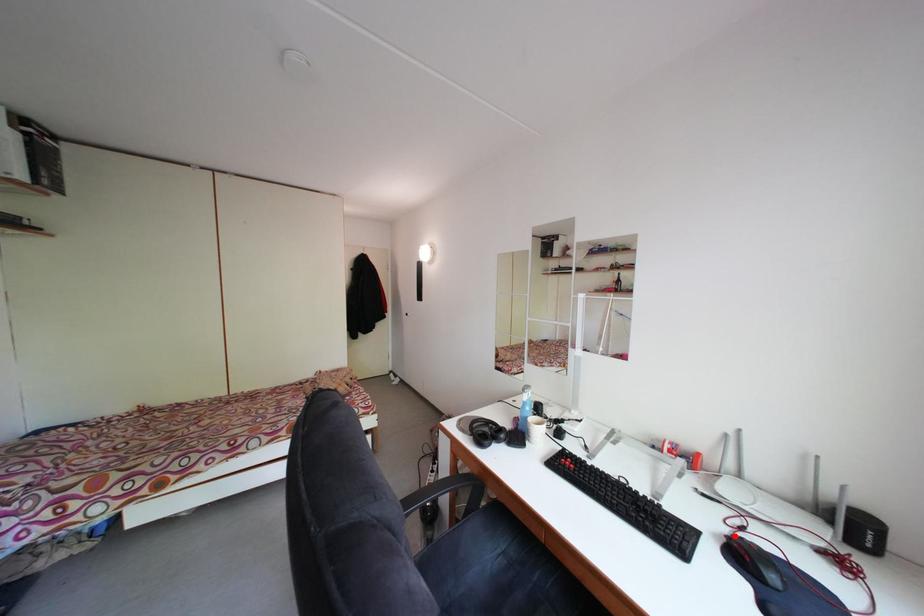
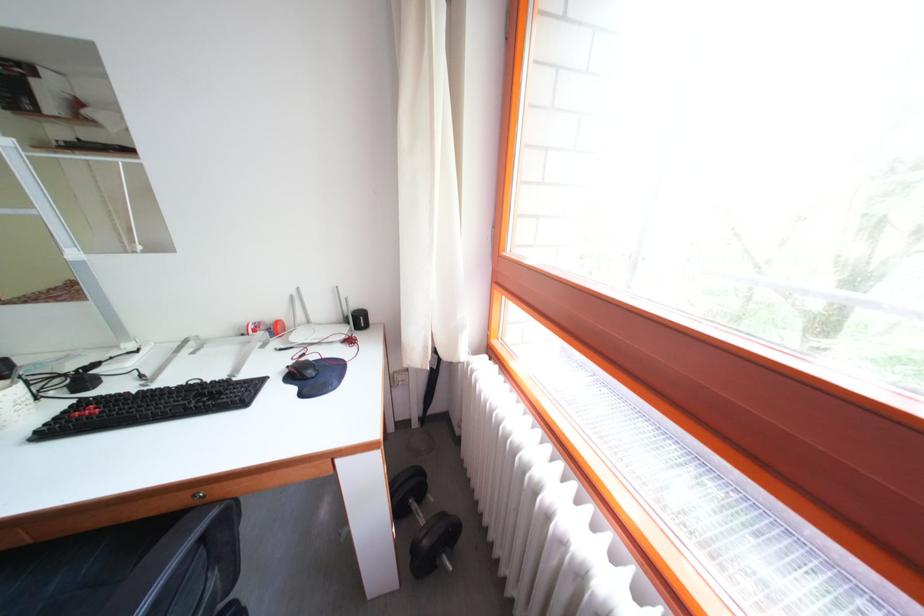
In the second image, find the point that corresponds to the highlighted location in the first image.

(298, 370)